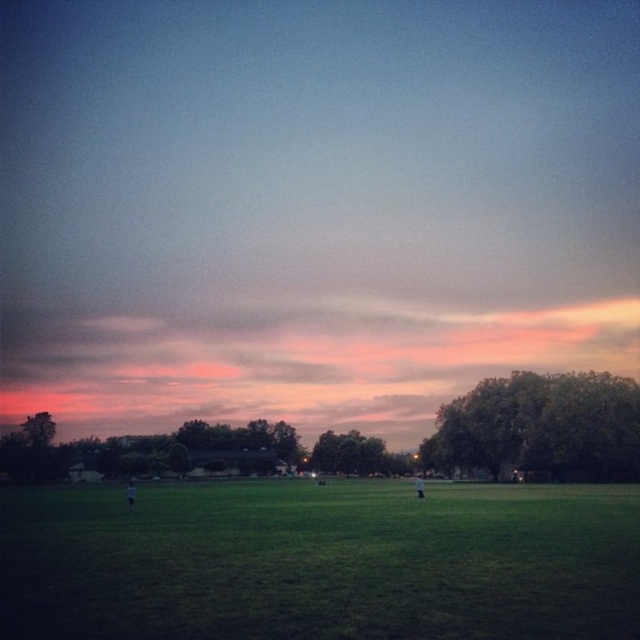
Question: Can you confirm if green grass at center is positioned above white cotton shirt at center?

Choices:
 (A) no
 (B) yes

Answer: (B)

Question: Which point is closer to the camera?

Choices:
 (A) green grass at center
 (B) white cotton shirt at center

Answer: (A)

Question: Which is farther from the green grass at center?

Choices:
 (A) dark gray fabric at center
 (B) white cotton shirt at center

Answer: (B)

Question: Does dark gray fabric at center lie in front of white cotton shirt at center?

Choices:
 (A) yes
 (B) no

Answer: (A)

Question: Which point appears closest to the camera in this image?

Choices:
 (A) (131, 496)
 (B) (420, 492)

Answer: (A)

Question: Does dark gray fabric at center have a larger size compared to white cotton shirt at center?

Choices:
 (A) yes
 (B) no

Answer: (A)